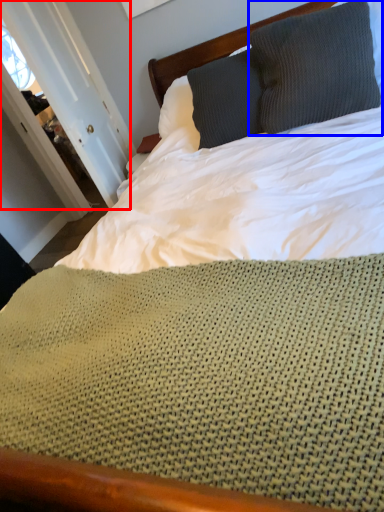
Question: Which of the following is the closest to the observer, door (highlighted by a red box) or pillow (highlighted by a blue box)?

Choices:
 (A) door
 (B) pillow

Answer: (B)